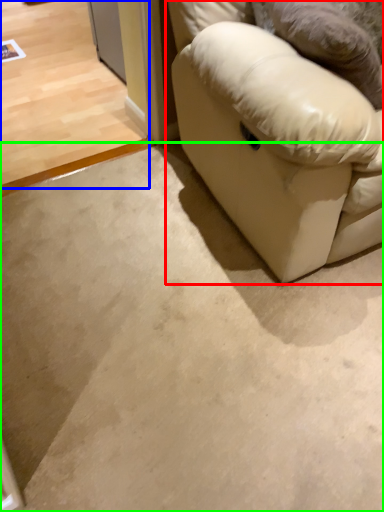
Question: Which is nearer to the studio couch (highlighted by a red box)? concrete (highlighted by a blue box) or concrete (highlighted by a green box).

Choices:
 (A) concrete
 (B) concrete

Answer: (B)